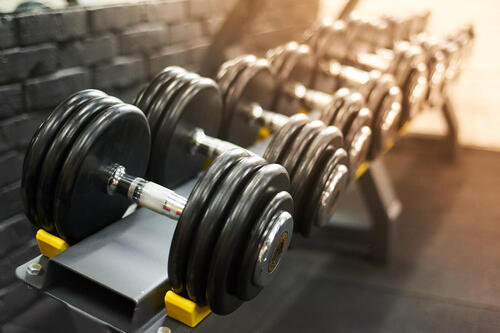
Identify the location of black gym floor mats. This screenshot has height=333, width=500. (303, 311), (462, 272), (466, 196), (397, 152), (240, 308), (302, 256), (343, 201).